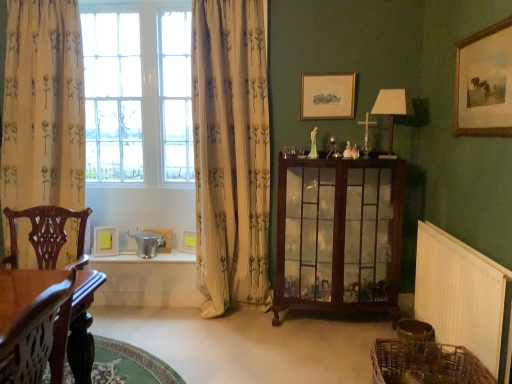
Locate an element on the screen. The height and width of the screenshot is (384, 512). vacant space to the left of white floral fabric curtain at left, acting as the 1th curtain starting from the right is located at coordinates (170, 322).